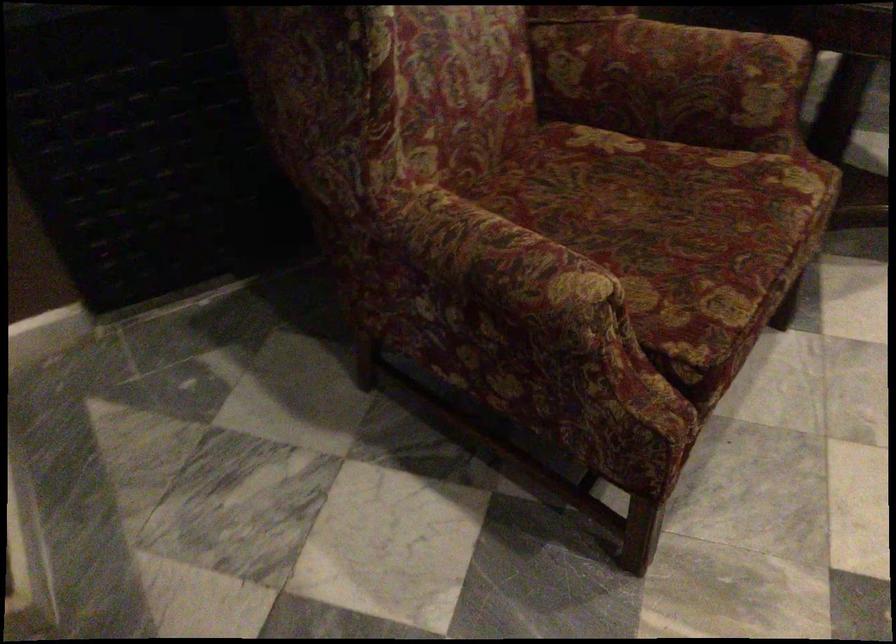
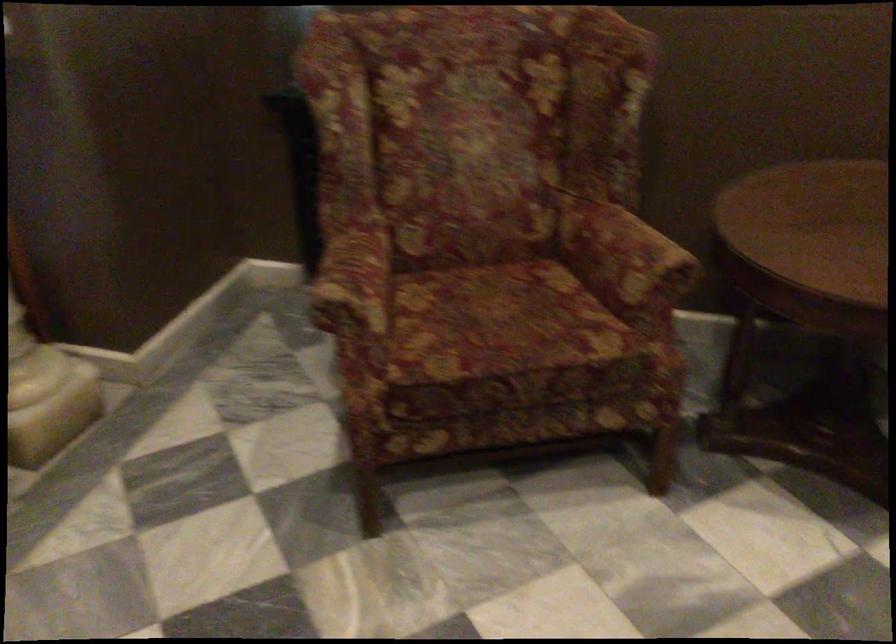
Find the pixel in the second image that matches [583,266] in the first image.

(355, 286)